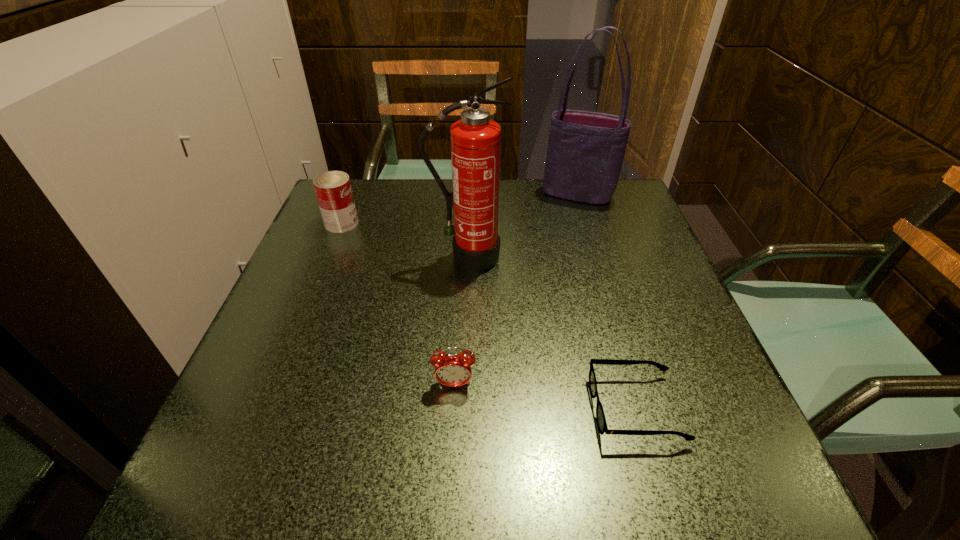
You are a GUI agent. You are given a task and a screenshot of the screen. Output one action in this format:
    pyautogui.click(x=<x>, y=<y>)
    Task: Click on the free space located on the arms of the shortest object
    The width and height of the screenshot is (960, 540).
    Given the screenshot: What is the action you would take?
    pyautogui.click(x=539, y=408)

The image size is (960, 540). In order to click on free region located on the arms of the shortest object in this screenshot , I will do tap(428, 408).

The image size is (960, 540). I want to click on free space located 0.280m on the arms of the shortest object, so click(421, 408).

At what (x,y) coordinates should I click in order to perform the action: click on tote bag positioned at the far edge. Please return your answer as a coordinate pair (x, y). The image size is (960, 540). Looking at the image, I should click on (585, 153).

This screenshot has width=960, height=540. Find the location of `can that is at the far edge`. can that is at the far edge is located at coordinates (333, 190).

The image size is (960, 540). I want to click on object that is positioned at the near edge, so click(600, 416).

Image resolution: width=960 pixels, height=540 pixels. In order to click on object that is positioned at the left edge in this screenshot , I will do `click(333, 190)`.

What are the coordinates of `tote bag present at the right edge` in the screenshot? It's located at (585, 153).

Where is `spectacles that is at the right edge`? This screenshot has width=960, height=540. spectacles that is at the right edge is located at coordinates (600, 416).

Identify the location of object that is at the far left corner. (333, 190).